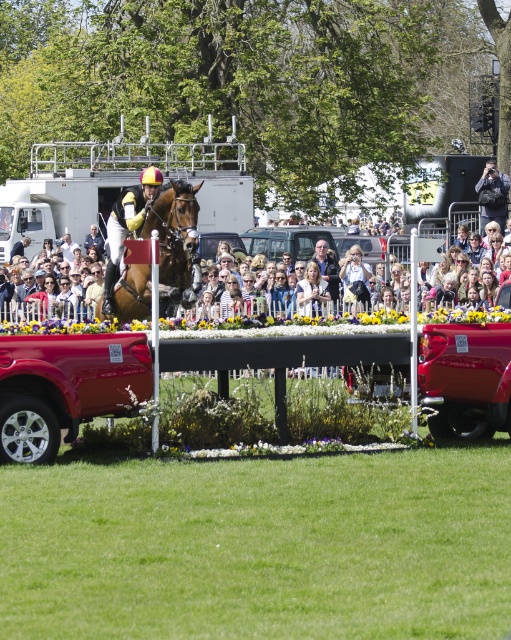
In the scene shown: You are a photographer positioned at the edge of the equestrian event. You see the brown glossy horse at center and the light brown leather jacket at center. Which object is closer to your right side?

The light brown leather jacket at center is closer to your right side because the brown glossy horse at center is to the left of it.

You are a photographer positioned at the bottom left corner of the image. You want to take a photo of the light brown leather jacket at center. Which direction should you move your camera to frame it properly?

The light brown leather jacket at center is located at point 0.434 on the x axis and 0.697 on the y axis. Since you are at the bottom left corner, you need to move your camera to the right and upwards to frame the jacket properly.

You are a photographer standing at the center of the equestrian event. You want to take a photo of the brown glossy horse at center and the light brown leather jacket at center. Given that your camera has a maximum focus range of 30 feet, will both subjects be in focus?

The brown glossy horse at center is 32.16 feet from the light brown leather jacket at center. Since the distance between them exceeds the camera maximum focus range of 30 feet, both subjects cannot be in focus at the same time.